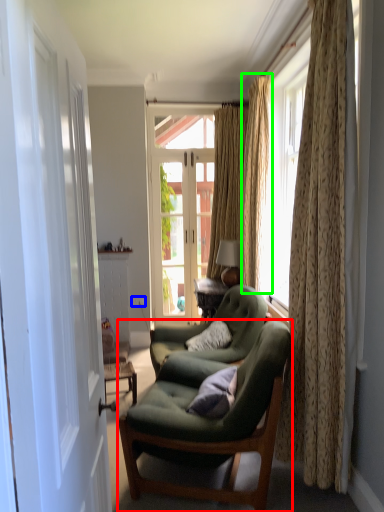
Question: Based on their relative distances, which object is nearer to chair (highlighted by a red box)? Choose from power outlet (highlighted by a blue box) and curtain (highlighted by a green box).

Choices:
 (A) power outlet
 (B) curtain

Answer: (B)